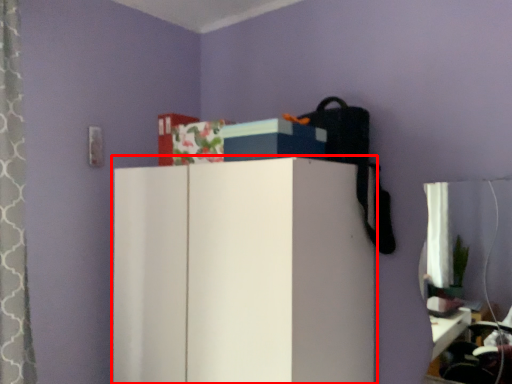
Question: Considering the relative positions of furniture (annotated by the red box) and storage box in the image provided, where is furniture (annotated by the red box) located with respect to the staircase?

Choices:
 (A) right
 (B) left

Answer: (B)